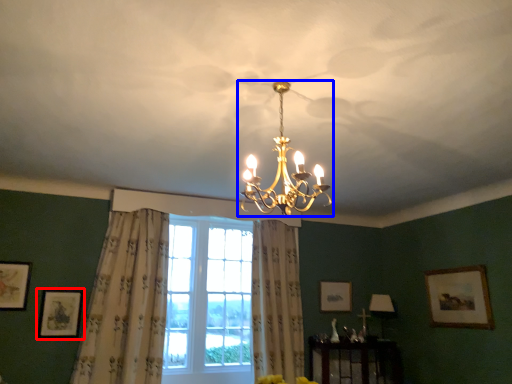
Question: Which of the following is the farthest to the observer, picture frame (highlighted by a red box) or lamp (highlighted by a blue box)?

Choices:
 (A) picture frame
 (B) lamp

Answer: (A)